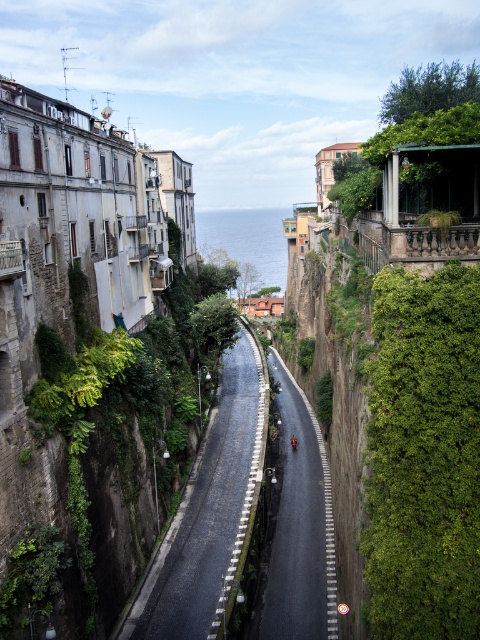
Question: Which point appears farthest from the camera in this image?

Choices:
 (A) (111, 573)
 (B) (456, 528)
 (C) (290, 486)
 (D) (264, 392)

Answer: (D)

Question: Where is green leafy vegetation at center located in relation to metallic red motorcycle at center in the image?

Choices:
 (A) left
 (B) right

Answer: (A)

Question: Among these objects, which one is nearest to the camera?

Choices:
 (A) black asphalt road at center
 (B) metallic red motorcycle at center
 (C) green leafy vegetation at center
 (D) green leafy wall at right

Answer: (D)

Question: Does green leafy vegetation at center have a lesser width compared to black asphalt road at center?

Choices:
 (A) no
 (B) yes

Answer: (A)

Question: Which object is farther from the camera taking this photo?

Choices:
 (A) green leafy wall at right
 (B) metallic red motorcycle at center
 (C) green leafy vegetation at center

Answer: (B)

Question: Observing the image, what is the correct spatial positioning of green leafy vegetation at center in reference to black asphalt road at center?

Choices:
 (A) left
 (B) right

Answer: (A)